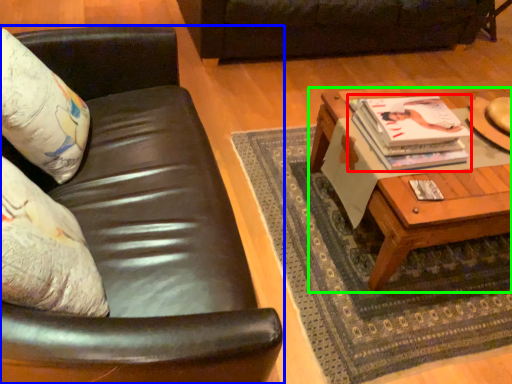
Question: Which object is positioned closest to magazine (highlighted by a red box)? Select from studio couch (highlighted by a blue box) and coffee table (highlighted by a green box).

Choices:
 (A) studio couch
 (B) coffee table

Answer: (B)